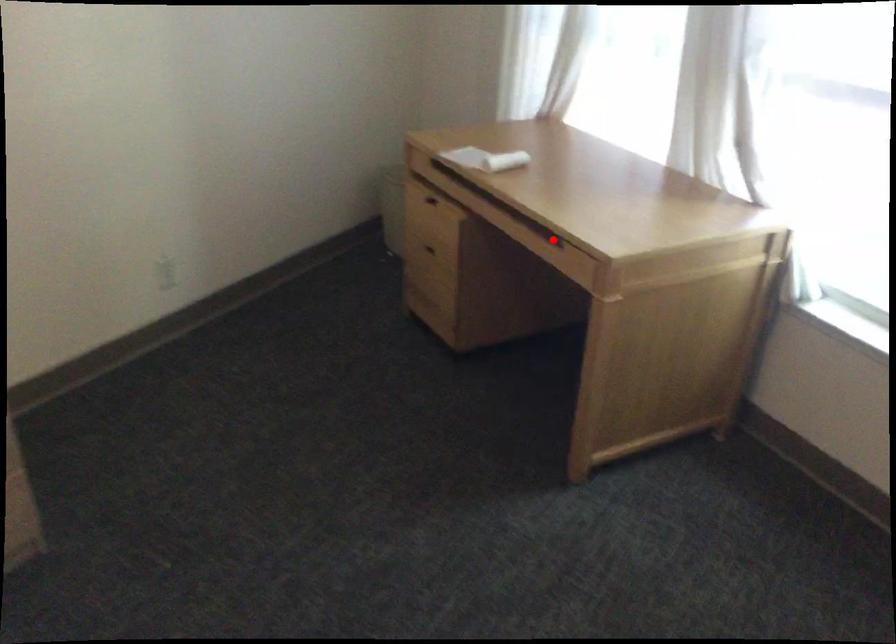
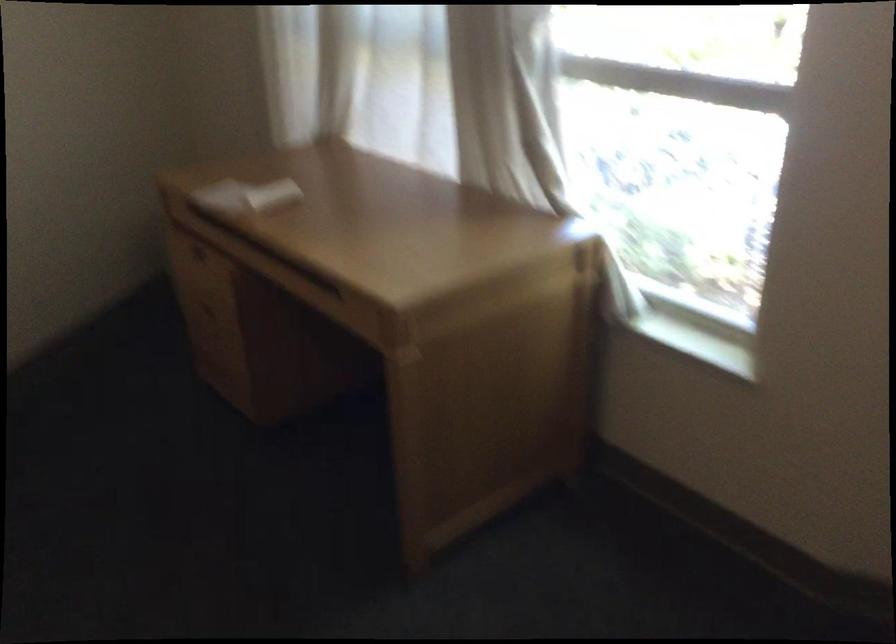
Question: I am providing you with two images of the same scene from different viewpoints. A red point is shown in image1. For the corresponding object point in image2, is it positioned nearer or farther from the camera?

Choices:
 (A) Nearer
 (B) Farther

Answer: (A)